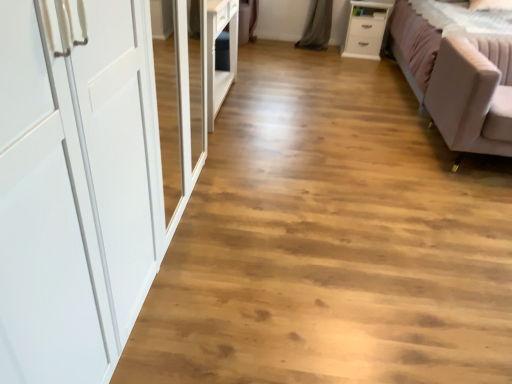
Question: Should I look upward or downward to see light pink fabric studio couch at right?

Choices:
 (A) down
 (B) up

Answer: (B)

Question: Is light pink fabric studio couch at right not within matte white wardrobe at left?

Choices:
 (A) yes
 (B) no

Answer: (A)

Question: Considering the relative sizes of light pink fabric studio couch at right and matte white wardrobe at left in the image provided, is light pink fabric studio couch at right bigger than matte white wardrobe at left?

Choices:
 (A) no
 (B) yes

Answer: (B)

Question: Are light pink fabric studio couch at right and matte white wardrobe at left making contact?

Choices:
 (A) no
 (B) yes

Answer: (A)

Question: Is the depth of light pink fabric studio couch at right greater than that of matte white wardrobe at left?

Choices:
 (A) no
 (B) yes

Answer: (B)

Question: From a real-world perspective, is light pink fabric studio couch at right over matte white wardrobe at left?

Choices:
 (A) no
 (B) yes

Answer: (B)

Question: Is light pink fabric studio couch at right at the left side of matte white wardrobe at left?

Choices:
 (A) yes
 (B) no

Answer: (B)

Question: Is light pink fabric studio couch at right outside white glossy chest of drawers at upper right?

Choices:
 (A) yes
 (B) no

Answer: (A)

Question: From the image's perspective, is light pink fabric studio couch at right located beneath white glossy chest of drawers at upper right?

Choices:
 (A) no
 (B) yes

Answer: (B)

Question: Is the position of light pink fabric studio couch at right more distant than that of white glossy chest of drawers at upper right?

Choices:
 (A) no
 (B) yes

Answer: (A)

Question: Can you confirm if light pink fabric studio couch at right is positioned to the right of white glossy chest of drawers at upper right?

Choices:
 (A) yes
 (B) no

Answer: (A)

Question: Considering the relative sizes of light pink fabric studio couch at right and white glossy chest of drawers at upper right in the image provided, is light pink fabric studio couch at right taller than white glossy chest of drawers at upper right?

Choices:
 (A) yes
 (B) no

Answer: (A)

Question: Is light pink fabric studio couch at right at the left side of white glossy chest of drawers at upper right?

Choices:
 (A) yes
 (B) no

Answer: (B)

Question: Does matte white wardrobe at left have a greater width compared to light pink fabric studio couch at right?

Choices:
 (A) no
 (B) yes

Answer: (B)